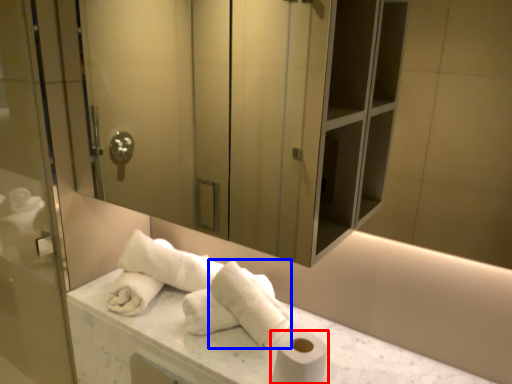
Question: Which object appears closest to the camera in this image, toilet paper (highlighted by a red box) or bath towel (highlighted by a blue box)?

Choices:
 (A) toilet paper
 (B) bath towel

Answer: (A)